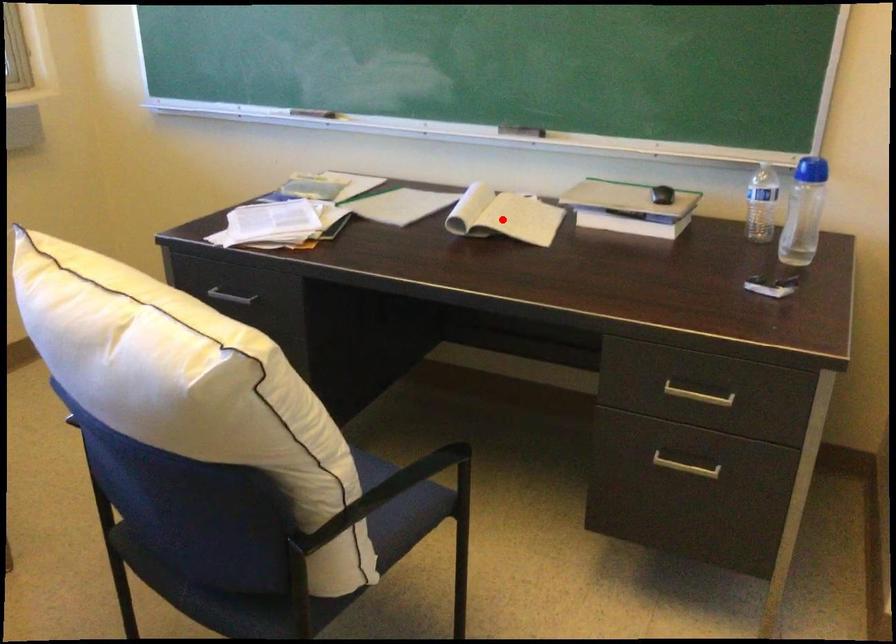
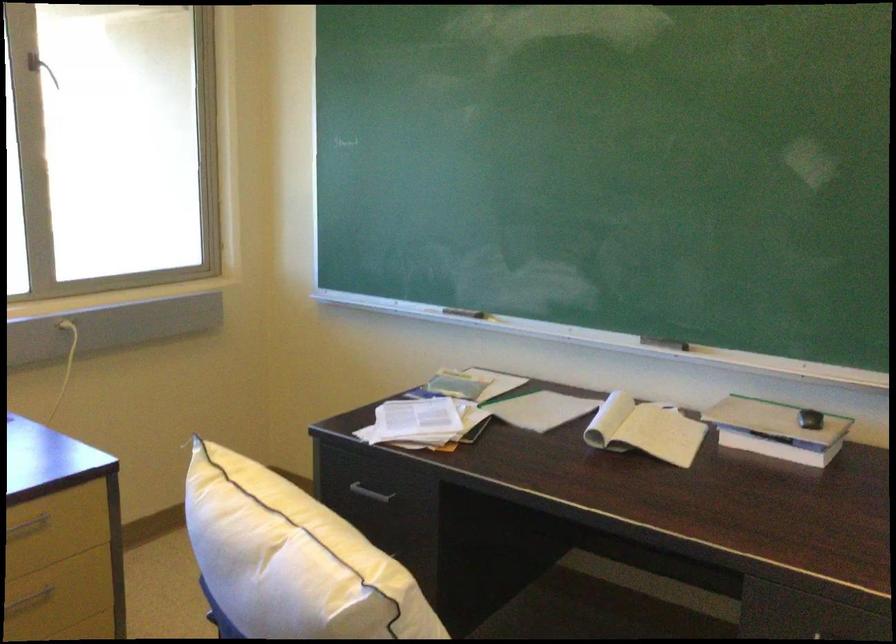
Where in the second image is the point corresponding to the highlighted location from the first image?

(644, 430)